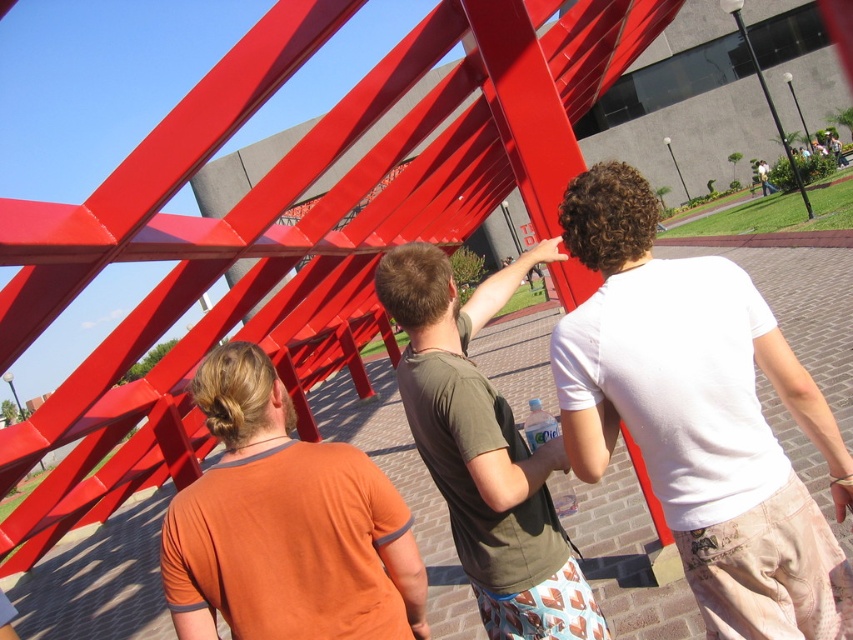
Who is positioned more to the left, orange cotton shirt at center or white cotton shirt at upper center?

orange cotton shirt at center

Is point (410, 586) closer to camera compared to point (769, 189)?

Yes, point (410, 586) is in front of point (769, 189).

Is point (213, 376) closer to viewer compared to point (761, 166)?

Yes.

I want to click on orange cotton shirt at center, so click(285, 524).

How much distance is there between matte green t-shirt at center and white cotton shirt at upper center?

A distance of 26.55 meters exists between matte green t-shirt at center and white cotton shirt at upper center.

Measure the distance between matte green t-shirt at center and white cotton shirt at upper center.

matte green t-shirt at center and white cotton shirt at upper center are 87.11 feet apart.

Is point (521, 552) in front of point (763, 184)?

Yes, point (521, 552) is in front of point (763, 184).

Locate an element on the screen. matte green t-shirt at center is located at coordinates (485, 451).

Is orange cotton shirt at center bigger than matte green t-shirt at center?

Actually, orange cotton shirt at center might be smaller than matte green t-shirt at center.

The height and width of the screenshot is (640, 853). I want to click on orange cotton shirt at center, so click(x=285, y=524).

Locate an element on the screen. orange cotton shirt at center is located at coordinates (285, 524).